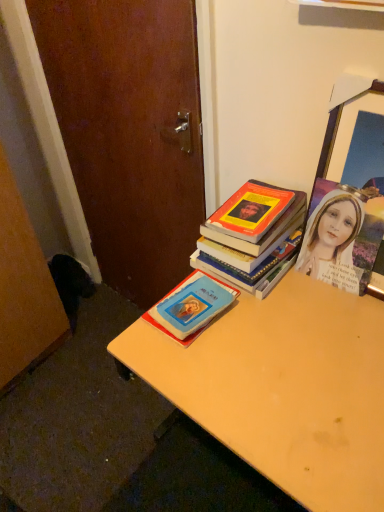
You are a GUI agent. You are given a task and a screenshot of the screen. Output one action in this format:
    pyautogui.click(x=<x>, y=<y>)
    Task: Click on the vacant space in front of wooden picture frame at upper right
    This screenshot has width=384, height=512.
    Given the screenshot: What is the action you would take?
    pyautogui.click(x=334, y=334)